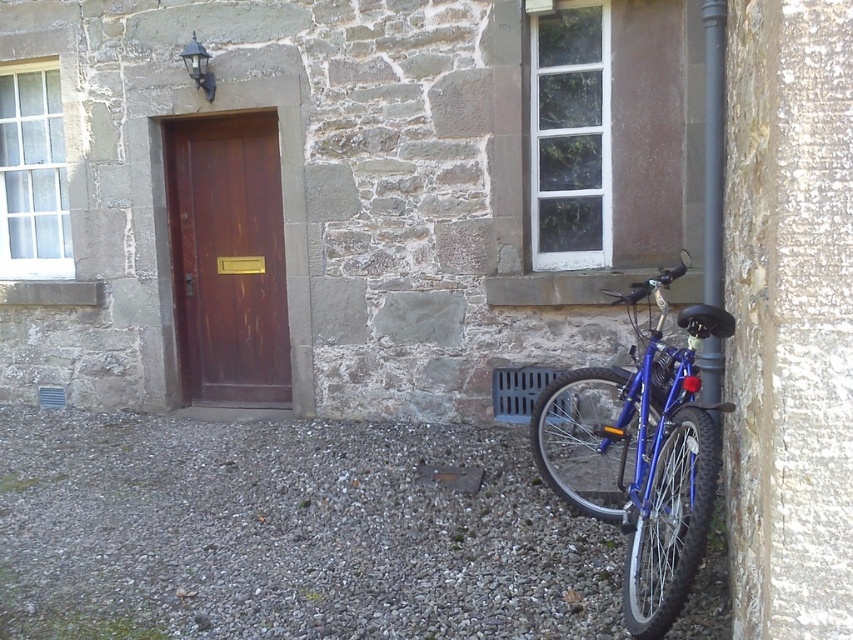
Is blue metallic bicycle at right positioned behind brown wooden door at center?

No, it is not.

Can you confirm if blue metallic bicycle at right is smaller than brown wooden door at center?

No.

Between point (650, 404) and point (178, 317), which one is positioned behind?

The point (178, 317) is more distant.

At what (x,y) coordinates should I click in order to perform the action: click on blue metallic bicycle at right. Please return your answer as a coordinate pair (x, y). The height and width of the screenshot is (640, 853). Looking at the image, I should click on (641, 452).